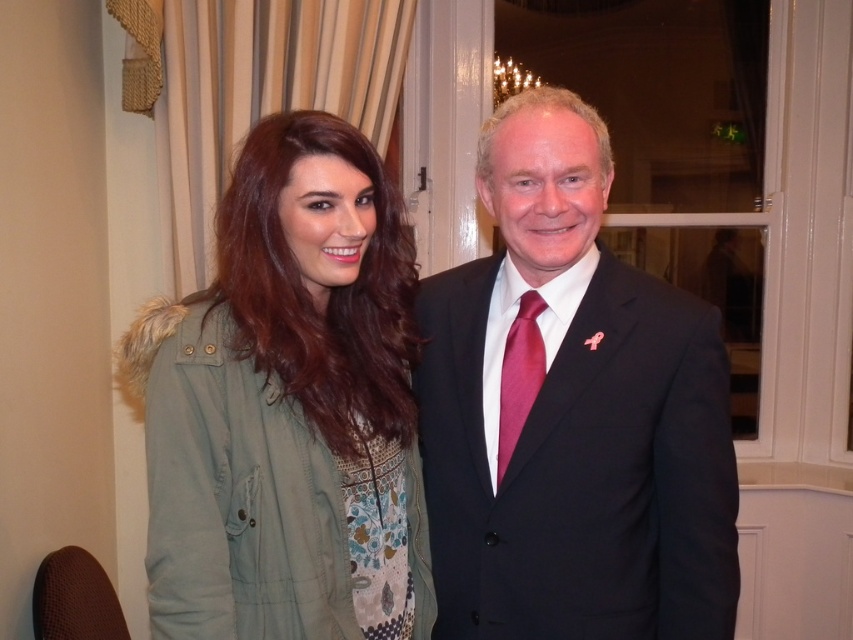
Question: Which point is farther from the camera taking this photo?

Choices:
 (A) (514, 348)
 (B) (236, 182)
 (C) (503, 401)

Answer: (A)

Question: Which is nearer to the green fabric jacket at left?

Choices:
 (A) black suit at center
 (B) shiny magenta tie at center

Answer: (A)

Question: Is black suit at center positioned at the back of green fabric jacket at left?

Choices:
 (A) yes
 (B) no

Answer: (A)

Question: Does black suit at center appear under green fabric jacket at left?

Choices:
 (A) no
 (B) yes

Answer: (A)

Question: Is black suit at center to the right of shiny magenta tie at center from the viewer's perspective?

Choices:
 (A) no
 (B) yes

Answer: (B)

Question: Which is farther from the shiny magenta tie at center?

Choices:
 (A) green fabric jacket at left
 (B) black suit at center

Answer: (A)